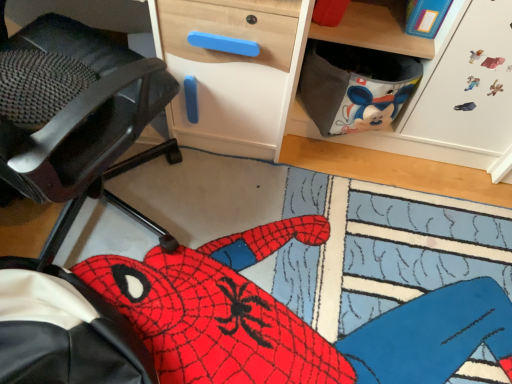
Question: Is wooden desk at upper right facing away from black mesh chair at left?

Choices:
 (A) no
 (B) yes

Answer: (A)

Question: Is wooden desk at upper right shorter than black mesh chair at left?

Choices:
 (A) no
 (B) yes

Answer: (A)

Question: Are wooden desk at upper right and black mesh chair at left making contact?

Choices:
 (A) yes
 (B) no

Answer: (B)

Question: Does wooden desk at upper right lie in front of black mesh chair at left?

Choices:
 (A) no
 (B) yes

Answer: (A)

Question: Considering the relative positions of wooden desk at upper right and black mesh chair at left in the image provided, is wooden desk at upper right to the left of black mesh chair at left from the viewer's perspective?

Choices:
 (A) no
 (B) yes

Answer: (A)

Question: Considering the relative positions of black mesh chair at left and wooden desk at upper right in the image provided, is black mesh chair at left to the left or to the right of wooden desk at upper right?

Choices:
 (A) left
 (B) right

Answer: (A)

Question: Looking at their shapes, would you say black mesh chair at left is wider or thinner than wooden desk at upper right?

Choices:
 (A) thin
 (B) wide

Answer: (A)

Question: Is point (67, 168) positioned closer to the camera than point (208, 51)?

Choices:
 (A) closer
 (B) farther

Answer: (A)

Question: In terms of height, does black mesh chair at left look taller or shorter compared to wooden desk at upper right?

Choices:
 (A) short
 (B) tall

Answer: (A)

Question: Looking at the image, does wooden desk at upper right seem bigger or smaller compared to red plush spider at lower left?

Choices:
 (A) big
 (B) small

Answer: (A)

Question: From the image's perspective, relative to red plush spider at lower left, is wooden desk at upper right above or below?

Choices:
 (A) below
 (B) above

Answer: (B)

Question: Considering the positions of wooden desk at upper right and red plush spider at lower left in the image, is wooden desk at upper right wider or thinner than red plush spider at lower left?

Choices:
 (A) thin
 (B) wide

Answer: (A)

Question: Visually, is wooden desk at upper right positioned to the left or to the right of red plush spider at lower left?

Choices:
 (A) left
 (B) right

Answer: (B)

Question: From a real-world perspective, is red plush spider at lower left positioned above or below wooden desk at upper right?

Choices:
 (A) below
 (B) above

Answer: (A)

Question: Relative to wooden desk at upper right, is red plush spider at lower left in front or behind?

Choices:
 (A) behind
 (B) front

Answer: (A)